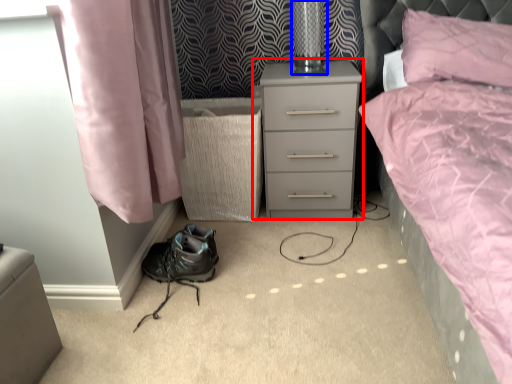
Question: Which of the following is the farthest to the observer, nightstand (highlighted by a red box) or table lamp (highlighted by a blue box)?

Choices:
 (A) nightstand
 (B) table lamp

Answer: (B)